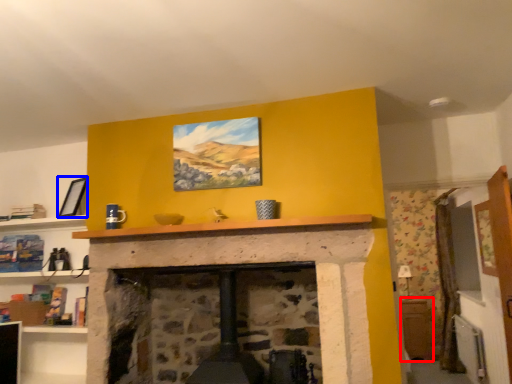
Question: Which object is further to the camera taking this photo, table (highlighted by a red box) or picture frame (highlighted by a blue box)?

Choices:
 (A) table
 (B) picture frame

Answer: (A)